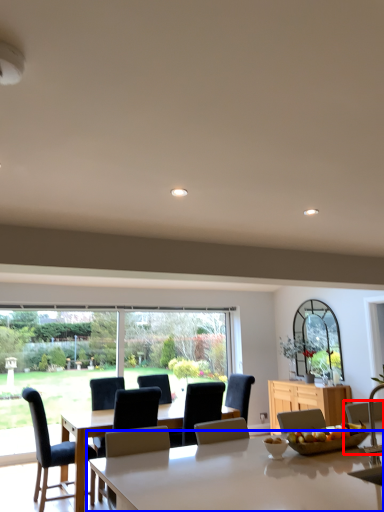
Question: Which of the following is the closest to the observer, chair (highlighted by a red box) or table (highlighted by a blue box)?

Choices:
 (A) chair
 (B) table

Answer: (B)